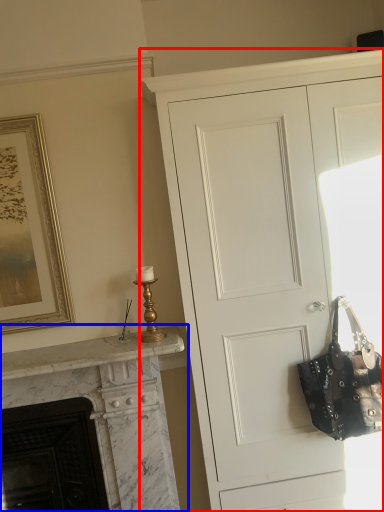
Question: Which object appears farthest to the camera in this image, cupboard (highlighted by a red box) or fireplace (highlighted by a blue box)?

Choices:
 (A) cupboard
 (B) fireplace

Answer: (B)